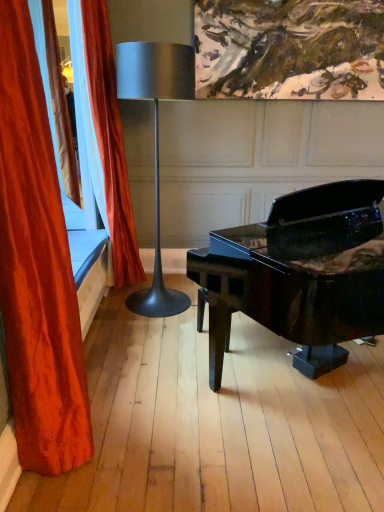
Where is `empty space that is to the right of velvet red curtain at left, the 2th curtain viewed from the back`? The image size is (384, 512). empty space that is to the right of velvet red curtain at left, the 2th curtain viewed from the back is located at coordinates (139, 440).